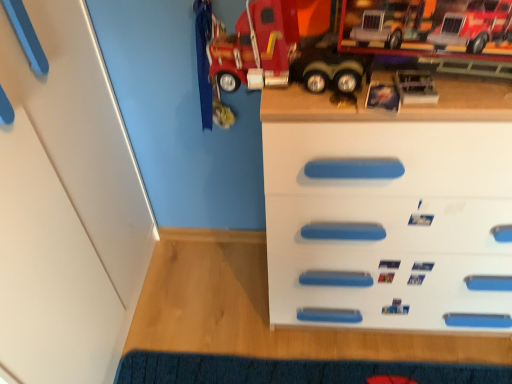
Image resolution: width=512 pixels, height=384 pixels. I want to click on white plastic chest of drawers at center, so click(391, 209).

This screenshot has height=384, width=512. Describe the element at coordinates (391, 209) in the screenshot. I see `white plastic chest of drawers at center` at that location.

Find the location of a particular element. blue textured mat at lower center is located at coordinates (294, 371).

Describe the element at coordinates (294, 371) in the screenshot. I see `blue textured mat at lower center` at that location.

Image resolution: width=512 pixels, height=384 pixels. I want to click on white plastic chest of drawers at center, so 391,209.

Considering the relative positions of blue textured mat at lower center and white plastic chest of drawers at center in the image provided, is blue textured mat at lower center to the left of white plastic chest of drawers at center from the viewer's perspective?

Yes, blue textured mat at lower center is to the left of white plastic chest of drawers at center.

Which object is more forward, blue textured mat at lower center or white plastic chest of drawers at center?

white plastic chest of drawers at center.

Is point (195, 366) more distant than point (349, 164)?

Yes, point (195, 366) is behind point (349, 164).

From the image's perspective, is blue textured mat at lower center beneath white plastic chest of drawers at center?

Yes, from the image's perspective, blue textured mat at lower center is below white plastic chest of drawers at center.

From a real-world perspective, relative to white plastic chest of drawers at center, is blue textured mat at lower center vertically above or below?

Clearly, from a real-world perspective, blue textured mat at lower center is below white plastic chest of drawers at center.

Can you confirm if blue textured mat at lower center is thinner than white plastic chest of drawers at center?

Indeed, blue textured mat at lower center has a lesser width compared to white plastic chest of drawers at center.

Which of these two, blue textured mat at lower center or white plastic chest of drawers at center, stands taller?

white plastic chest of drawers at center is taller.

In the scene shown: Between blue textured mat at lower center and white plastic chest of drawers at center, which one has larger size?

Bigger between the two is white plastic chest of drawers at center.

Is blue textured mat at lower center located outside white plastic chest of drawers at center?

Yes, blue textured mat at lower center is not within white plastic chest of drawers at center.

Is blue textured mat at lower center touching white plastic chest of drawers at center?

No, blue textured mat at lower center is not in contact with white plastic chest of drawers at center.

Does blue textured mat at lower center turn towards white plastic chest of drawers at center?

Yes, blue textured mat at lower center faces towards white plastic chest of drawers at center.

What's the angular difference between blue textured mat at lower center and white plastic chest of drawers at center's facing directions?

The angle between the facing direction of blue textured mat at lower center and the facing direction of white plastic chest of drawers at center is 180 degrees.

The height and width of the screenshot is (384, 512). In the image, there is a white plastic chest of drawers at center. In order to click on doormat below it (from a real-world perspective) in this screenshot , I will do `click(294, 371)`.

Visually, is white plastic chest of drawers at center positioned to the left or to the right of blue textured mat at lower center?

white plastic chest of drawers at center is positioned on blue textured mat at lower center's right side.

Which object is closer to the camera taking this photo, white plastic chest of drawers at center or blue textured mat at lower center?

white plastic chest of drawers at center.

Is point (480, 183) closer to viewer compared to point (293, 370)?

Yes, it is in front of point (293, 370).

From the image's perspective, is white plastic chest of drawers at center below blue textured mat at lower center?

No, from the image's perspective, white plastic chest of drawers at center is not beneath blue textured mat at lower center.

From a real-world perspective, is white plastic chest of drawers at center above or below blue textured mat at lower center?

From a real-world perspective, white plastic chest of drawers at center is physically above blue textured mat at lower center.

Considering the sizes of objects white plastic chest of drawers at center and blue textured mat at lower center in the image provided, who is thinner, white plastic chest of drawers at center or blue textured mat at lower center?

With smaller width is blue textured mat at lower center.

Who is taller, white plastic chest of drawers at center or blue textured mat at lower center?

white plastic chest of drawers at center is taller.

Considering the sizes of white plastic chest of drawers at center and blue textured mat at lower center in the image, is white plastic chest of drawers at center bigger or smaller than blue textured mat at lower center?

white plastic chest of drawers at center is bigger than blue textured mat at lower center.

Is white plastic chest of drawers at center completely or partially outside of blue textured mat at lower center?

Absolutely, white plastic chest of drawers at center is external to blue textured mat at lower center.

Does white plastic chest of drawers at center touch blue textured mat at lower center?

They are not placed beside each other.

Is white plastic chest of drawers at center looking in the opposite direction of blue textured mat at lower center?

That's not correct — white plastic chest of drawers at center is not looking away from blue textured mat at lower center.

How distant is white plastic chest of drawers at center from blue textured mat at lower center?

white plastic chest of drawers at center is 21.41 inches from blue textured mat at lower center.

The width and height of the screenshot is (512, 384). I want to click on doormat below the white plastic chest of drawers at center (from the image's perspective), so click(x=294, y=371).

What are the coordinates of `the chest of drawers in front of the blue textured mat at lower center` in the screenshot? It's located at (391, 209).

The image size is (512, 384). Identify the location of doormat that is on the left side of white plastic chest of drawers at center. (294, 371).